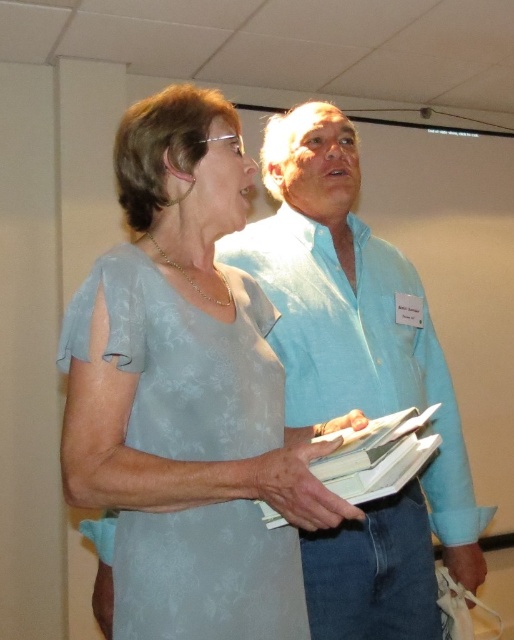
Consider the image. You are organizing a photo shoot and need to ensure that all subjects are visible. The scene has a light blue shirt at center and a matte blue dress at center. Which clothing item should you adjust to make sure both are fully visible?

The matte blue dress at center is behind the light blue shirt at center, so you should adjust the matte blue dress at center to move it forward to ensure both are fully visible.

Looking at this image, you are a photographer standing at the point marked as point (346, 364). You need to take a photo of both individuals in the scene. Can you fit both of them in the frame if your camera has a 6 feet wide field of view?

Yes, both individuals can be captured in the frame since they are 4.31 feet apart, which is within the 6 feet field of view of the camera.